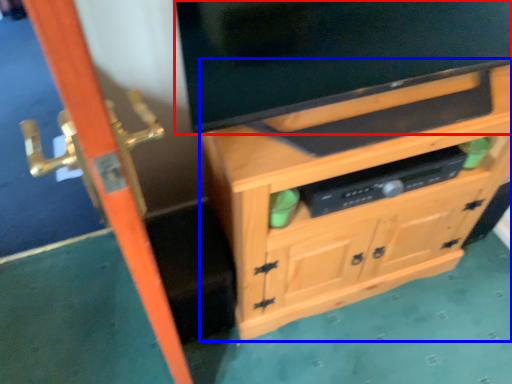
Question: Which point is closer to the camera, television (highlighted by a red box) or cabinetry (highlighted by a blue box)?

Choices:
 (A) television
 (B) cabinetry

Answer: (A)